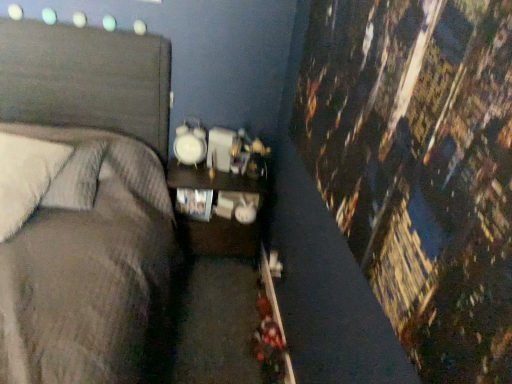
Question: Does point 50,178 appear closer or farther from the camera than point 239,238?

Choices:
 (A) closer
 (B) farther

Answer: (A)

Question: In the image, is white soft pillow at left, the first pillow positioned from the front, positioned in front of or behind matte wood nightstand at center?

Choices:
 (A) front
 (B) behind

Answer: (A)

Question: Considering the real-world distances, which object is farthest from the matte wood nightstand at center?

Choices:
 (A) white soft pillow at left, which ranks as the 1th pillow in back-to-front order
 (B) white soft pillow at left, the first pillow positioned from the front

Answer: (B)

Question: Which of these objects is positioned closest to the matte wood nightstand at center?

Choices:
 (A) white soft pillow at left, which ranks as the 1th pillow in back-to-front order
 (B) white soft pillow at left, the second pillow positioned from the back

Answer: (A)